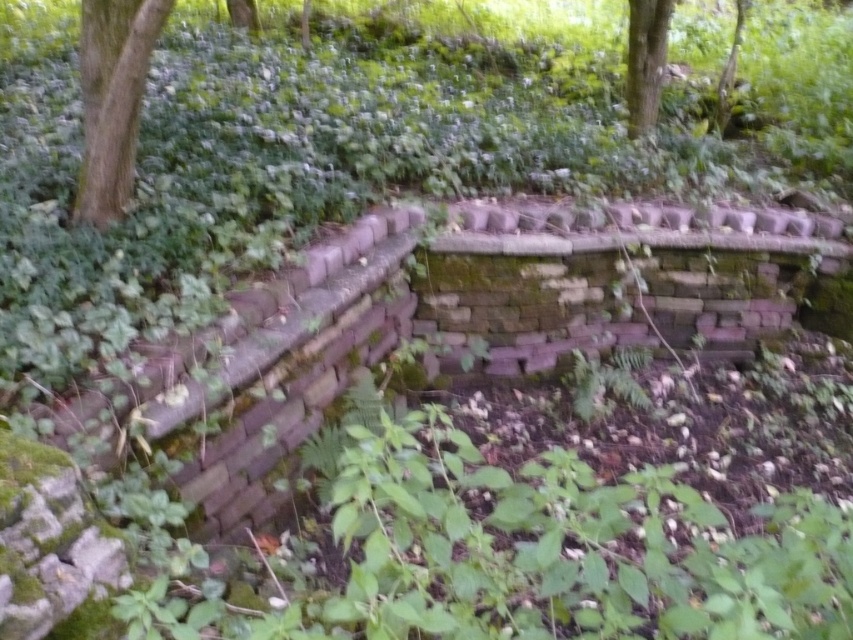
Question: In this image, where is green rough bark tree at upper left located relative to green mossy tree at upper center?

Choices:
 (A) above
 (B) below

Answer: (B)

Question: Where is green rough bark tree at upper left located in relation to green mossy tree at upper center in the image?

Choices:
 (A) above
 (B) below

Answer: (B)

Question: Which point is closer to the camera?

Choices:
 (A) green rough bark tree at upper left
 (B) green mossy tree at upper center

Answer: (A)

Question: Is green rough bark tree at upper left smaller than green mossy tree at upper center?

Choices:
 (A) no
 (B) yes

Answer: (A)